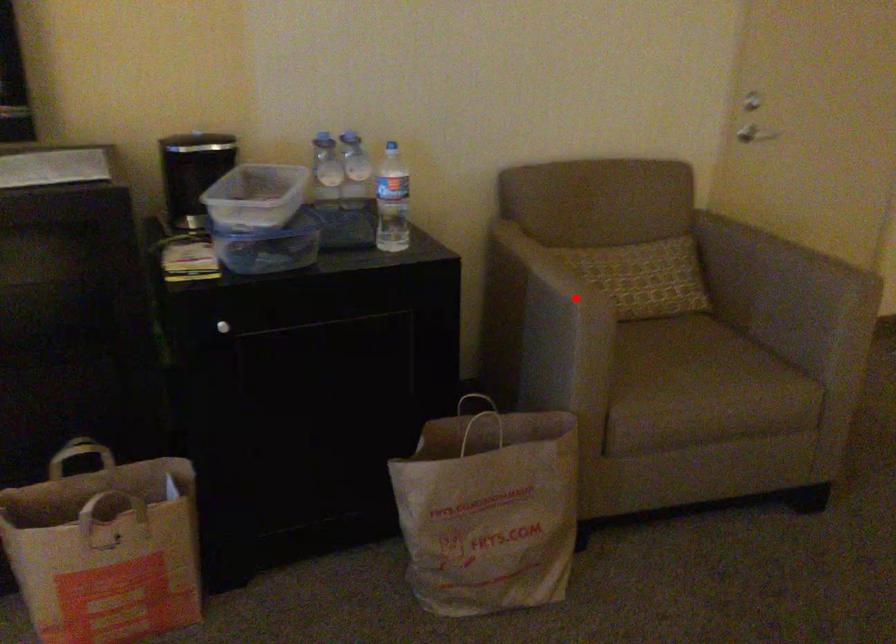
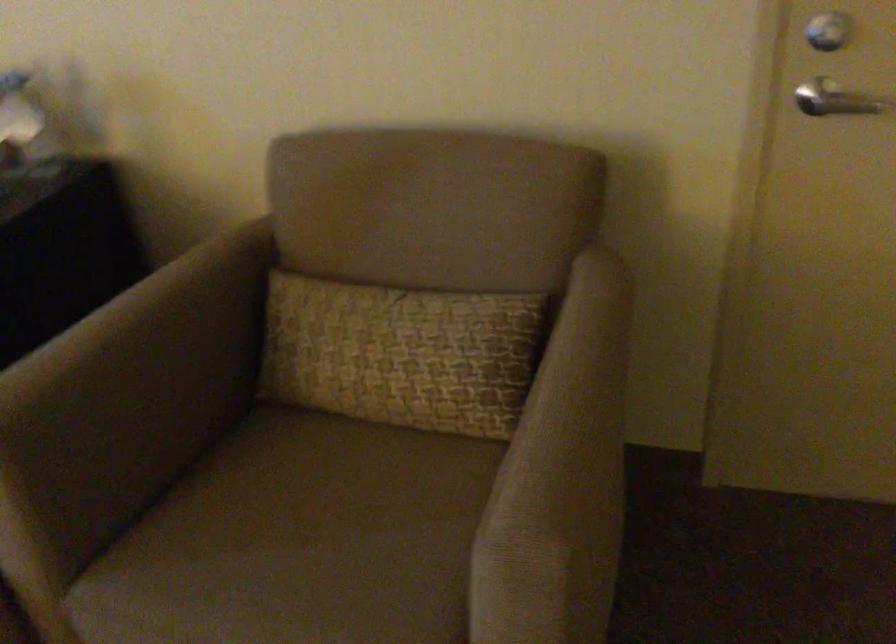
The point at the highlighted location is marked in the first image. Where is the corresponding point in the second image?

(135, 389)